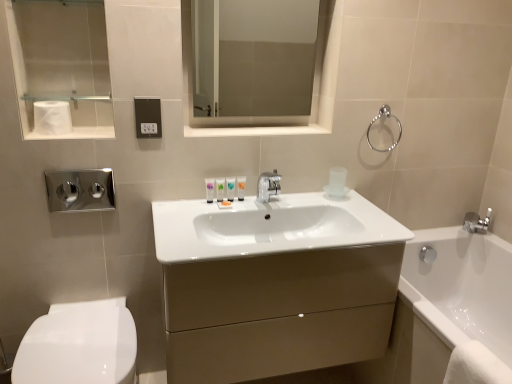
At what (x,y) coordinates should I click in order to perform the action: click on free space to the right of white glossy tube at center, positioned as the second toiletry in left-to-right order. Please return your answer as a coordinate pair (x, y). The width and height of the screenshot is (512, 384). Looking at the image, I should click on (256, 205).